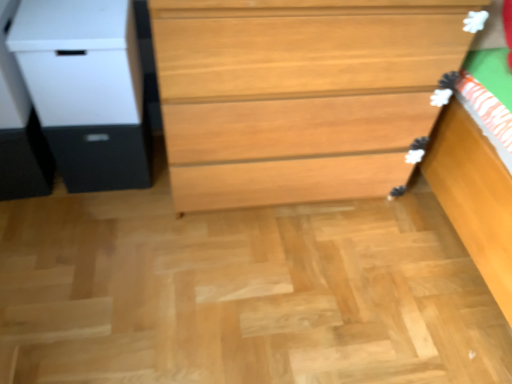
Question: Considering the relative positions of white matte file cabinet at left and light brown wood chest of drawers at center in the image provided, is white matte file cabinet at left in front of light brown wood chest of drawers at center?

Choices:
 (A) no
 (B) yes

Answer: (A)

Question: Is white matte file cabinet at left at the right side of light brown wood chest of drawers at center?

Choices:
 (A) yes
 (B) no

Answer: (B)

Question: From the image's perspective, is white matte file cabinet at left on light brown wood chest of drawers at center?

Choices:
 (A) no
 (B) yes

Answer: (B)

Question: Considering the relative sizes of white matte file cabinet at left and light brown wood chest of drawers at center in the image provided, is white matte file cabinet at left smaller than light brown wood chest of drawers at center?

Choices:
 (A) no
 (B) yes

Answer: (B)

Question: Does white matte file cabinet at left have a lesser width compared to light brown wood chest of drawers at center?

Choices:
 (A) yes
 (B) no

Answer: (A)

Question: From the image's perspective, is white matte file cabinet at left under light brown wood chest of drawers at center?

Choices:
 (A) no
 (B) yes

Answer: (A)

Question: Considering the relative sizes of light brown wood chest of drawers at center and white matte file cabinet at left in the image provided, is light brown wood chest of drawers at center bigger than white matte file cabinet at left?

Choices:
 (A) no
 (B) yes

Answer: (B)

Question: Could you tell me if light brown wood chest of drawers at center is turned towards white matte file cabinet at left?

Choices:
 (A) no
 (B) yes

Answer: (A)

Question: Considering the relative sizes of light brown wood chest of drawers at center and white matte file cabinet at left in the image provided, is light brown wood chest of drawers at center thinner than white matte file cabinet at left?

Choices:
 (A) yes
 (B) no

Answer: (B)

Question: From a real-world perspective, is light brown wood chest of drawers at center positioned over white matte file cabinet at left based on gravity?

Choices:
 (A) no
 (B) yes

Answer: (A)

Question: Is light brown wood chest of drawers at center shorter than white matte file cabinet at left?

Choices:
 (A) yes
 (B) no

Answer: (B)

Question: Does light brown wood chest of drawers at center have a smaller size compared to white matte file cabinet at left?

Choices:
 (A) yes
 (B) no

Answer: (B)

Question: Can you confirm if light brown wood chest of drawers at center is shorter than matte black drawer at left?

Choices:
 (A) no
 (B) yes

Answer: (A)